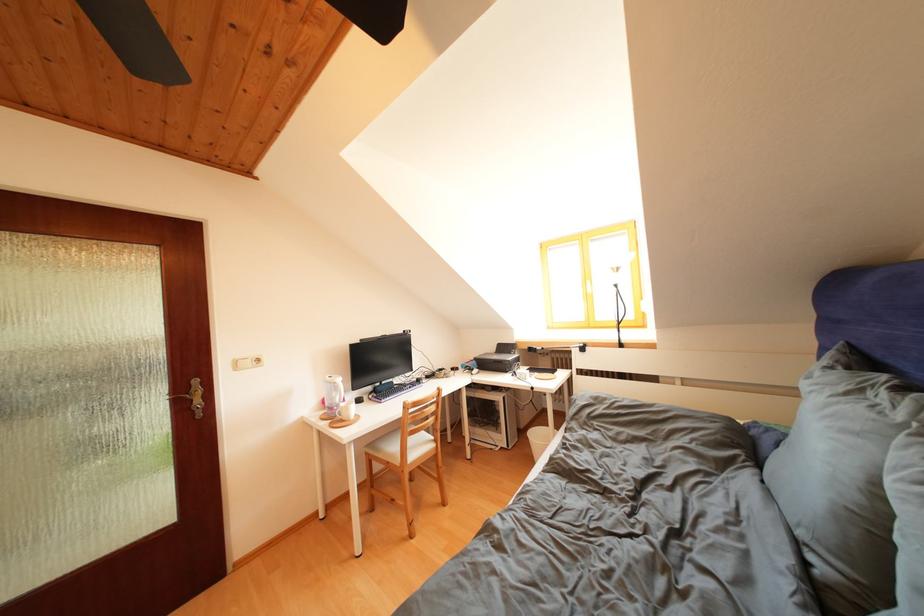
Where would you turn the black radiator knob? Please return your answer as a coordinate pair (x, y).

(193, 397)